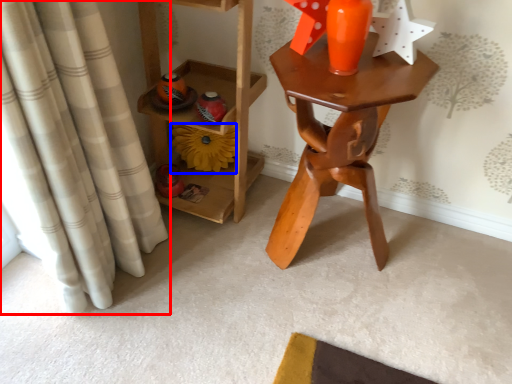
Question: Among these objects, which one is farthest to the camera, curtain (highlighted by a red box) or flower (highlighted by a blue box)?

Choices:
 (A) curtain
 (B) flower

Answer: (B)